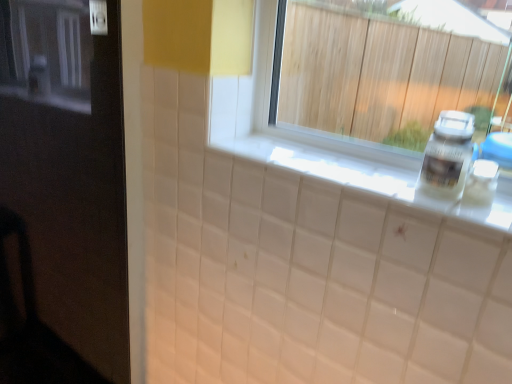
Question: From the image's perspective, is white plastic bottle at right beneath white glossy counter top at center?

Choices:
 (A) no
 (B) yes

Answer: (A)

Question: Considering the relative sizes of white plastic bottle at right and white glossy counter top at center in the image provided, is white plastic bottle at right bigger than white glossy counter top at center?

Choices:
 (A) yes
 (B) no

Answer: (B)

Question: Does white plastic bottle at right have a lesser height compared to white glossy counter top at center?

Choices:
 (A) yes
 (B) no

Answer: (B)

Question: Is white plastic bottle at right looking in the opposite direction of white glossy counter top at center?

Choices:
 (A) no
 (B) yes

Answer: (A)

Question: Are white plastic bottle at right and white glossy counter top at center far apart?

Choices:
 (A) no
 (B) yes

Answer: (B)

Question: From the image's perspective, is white plastic bottle at right located above or below white glossy counter top at center?

Choices:
 (A) above
 (B) below

Answer: (A)

Question: Considering the positions of white plastic bottle at right and white glossy counter top at center in the image, is white plastic bottle at right wider or thinner than white glossy counter top at center?

Choices:
 (A) wide
 (B) thin

Answer: (B)

Question: From their relative heights in the image, would you say white plastic bottle at right is taller or shorter than white glossy counter top at center?

Choices:
 (A) short
 (B) tall

Answer: (B)

Question: Considering their positions, is white plastic bottle at right located in front of or behind white glossy counter top at center?

Choices:
 (A) behind
 (B) front

Answer: (A)

Question: Choose the correct answer: Is white glossy counter top at center inside white plastic bottle at right or outside it?

Choices:
 (A) inside
 (B) outside

Answer: (B)

Question: Considering the positions of point (391, 195) and point (471, 153), is point (391, 195) closer or farther from the camera than point (471, 153)?

Choices:
 (A) farther
 (B) closer

Answer: (B)

Question: From a real-world perspective, relative to white plastic bottle at right, is white glossy counter top at center vertically above or below?

Choices:
 (A) below
 (B) above

Answer: (A)

Question: From the image's perspective, is white glossy counter top at center above or below white plastic bottle at right?

Choices:
 (A) above
 (B) below

Answer: (B)

Question: From the image's perspective, is black glossy door at left positioned above or below white glossy counter top at center?

Choices:
 (A) below
 (B) above

Answer: (A)

Question: Is black glossy door at left taller or shorter than white glossy counter top at center?

Choices:
 (A) short
 (B) tall

Answer: (B)